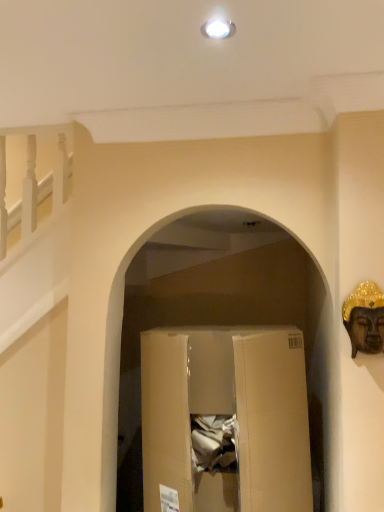
What is the approximate height of brown cardboard box at center?

brown cardboard box at center is 75.99 centimeters tall.

Locate an element on the screen. The width and height of the screenshot is (384, 512). brown cardboard box at center is located at coordinates (227, 414).

What do you see at coordinates (227, 414) in the screenshot?
I see `brown cardboard box at center` at bounding box center [227, 414].

Locate an element on the screen. This screenshot has width=384, height=512. gold metallic buddha head at right is located at coordinates (365, 318).

What do you see at coordinates (365, 318) in the screenshot? I see `gold metallic buddha head at right` at bounding box center [365, 318].

Identify the location of brown cardboard box at center. (227, 414).

Based on their positions, is gold metallic buddha head at right located to the left or right of brown cardboard box at center?

From the image, it's evident that gold metallic buddha head at right is to the right of brown cardboard box at center.

Is gold metallic buddha head at right positioned in front of brown cardboard box at center?

Yes, it is in front of brown cardboard box at center.

Does point (370, 311) lie behind point (304, 475)?

No.

From the image's perspective, is gold metallic buddha head at right located beneath brown cardboard box at center?

No, from the image's perspective, gold metallic buddha head at right is not beneath brown cardboard box at center.

From a real-world perspective, is gold metallic buddha head at right beneath brown cardboard box at center?

No, from a real-world perspective, gold metallic buddha head at right is not below brown cardboard box at center.

Based on the photo, can you confirm if gold metallic buddha head at right is thinner than brown cardboard box at center?

Yes.

In terms of height, does gold metallic buddha head at right look taller or shorter compared to brown cardboard box at center?

In the image, gold metallic buddha head at right appears to be shorter than brown cardboard box at center.

Who is bigger, gold metallic buddha head at right or brown cardboard box at center?

brown cardboard box at center.

Is gold metallic buddha head at right not within brown cardboard box at center?

That's correct, gold metallic buddha head at right is outside of brown cardboard box at center.

Is gold metallic buddha head at right directly adjacent to brown cardboard box at center?

No, gold metallic buddha head at right is not with brown cardboard box at center.

Consider the image. Is gold metallic buddha head at right positioned with its back to brown cardboard box at center?

No, brown cardboard box at center is not at the back of gold metallic buddha head at right.

Measure the distance between gold metallic buddha head at right and brown cardboard box at center.

20.16 inches.

Locate an element on the screen. The image size is (384, 512). cardboard box behind the gold metallic buddha head at right is located at coordinates (227, 414).

Considering the positions of objects brown cardboard box at center and gold metallic buddha head at right in the image provided, who is more to the left, brown cardboard box at center or gold metallic buddha head at right?

From the viewer's perspective, brown cardboard box at center appears more on the left side.

Is brown cardboard box at center further to the viewer compared to gold metallic buddha head at right?

Yes, it is behind gold metallic buddha head at right.

Which point is more forward, (283,433) or (382,298)?

Point (382,298)

From the image's perspective, which one is positioned lower, brown cardboard box at center or gold metallic buddha head at right?

brown cardboard box at center is shown below in the image.

From a real-world perspective, which object rests below the other?

brown cardboard box at center, from a real-world perspective.

Considering the relative sizes of brown cardboard box at center and gold metallic buddha head at right in the image provided, is brown cardboard box at center thinner than gold metallic buddha head at right?

No, brown cardboard box at center is not thinner than gold metallic buddha head at right.

Considering the relative sizes of brown cardboard box at center and gold metallic buddha head at right in the image provided, is brown cardboard box at center shorter than gold metallic buddha head at right?

Incorrect, the height of brown cardboard box at center does not fall short of that of gold metallic buddha head at right.

Can you confirm if brown cardboard box at center is smaller than gold metallic buddha head at right?

No.

Based on the photo, is gold metallic buddha head at right a part of brown cardboard box at center?

No, gold metallic buddha head at right is located outside of brown cardboard box at center.

In the scene shown: Is brown cardboard box at center not close to gold metallic buddha head at right?

brown cardboard box at center is near gold metallic buddha head at right, not far away.

In the scene shown: Is brown cardboard box at center facing away from gold metallic buddha head at right?

No, gold metallic buddha head at right is not at the back of brown cardboard box at center.

In the image, there is a gold metallic buddha head at right. Where is `cardboard box below it (from a real-world perspective)`? cardboard box below it (from a real-world perspective) is located at coordinates (227, 414).

Where is `construction worker lying above the brown cardboard box at center (from the image's perspective)`? construction worker lying above the brown cardboard box at center (from the image's perspective) is located at coordinates (365, 318).

This screenshot has height=512, width=384. I want to click on construction worker that appears on the right of brown cardboard box at center, so click(365, 318).